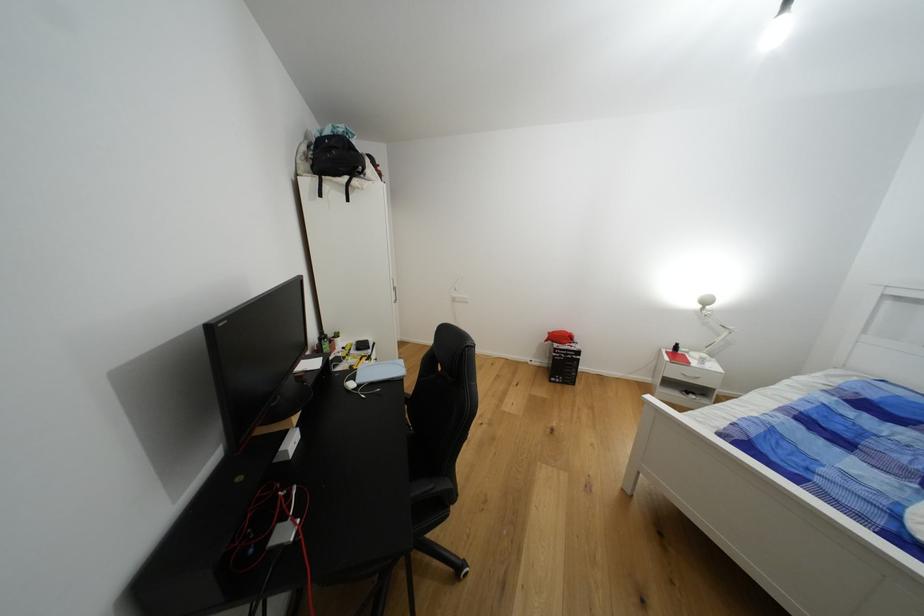
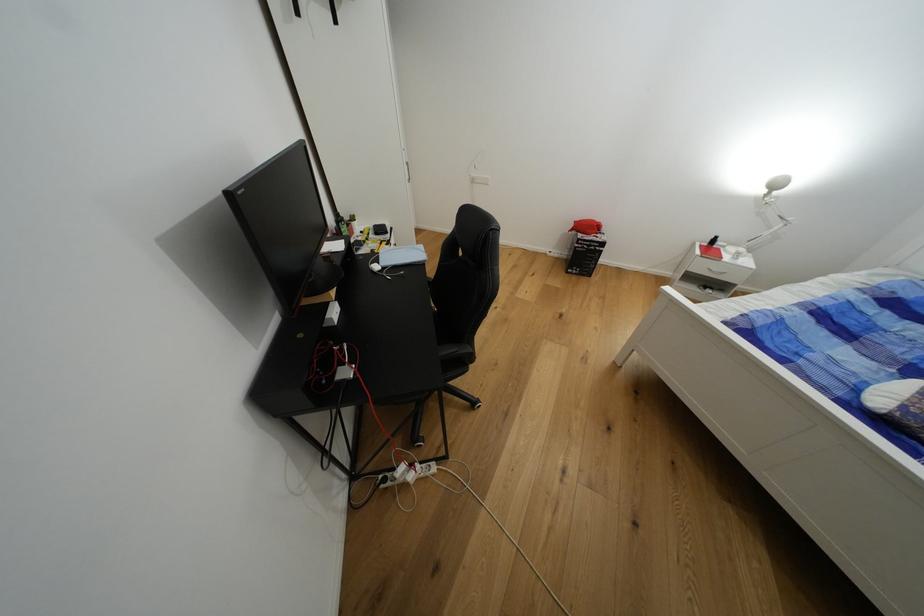
Locate, in the second image, the point that corresponds to point 436,488 in the first image.

(460, 351)